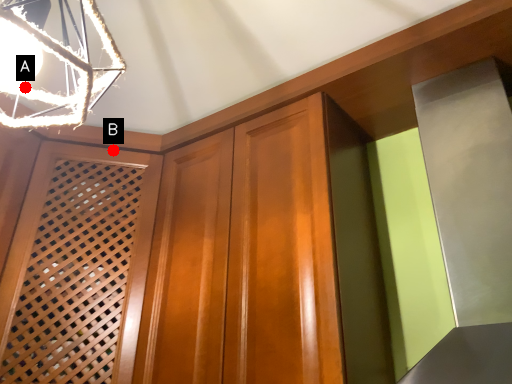
Question: Two points are circled on the image, labeled by A and B beside each circle. Which point is closer to the camera?

Choices:
 (A) A is closer
 (B) B is closer

Answer: (A)